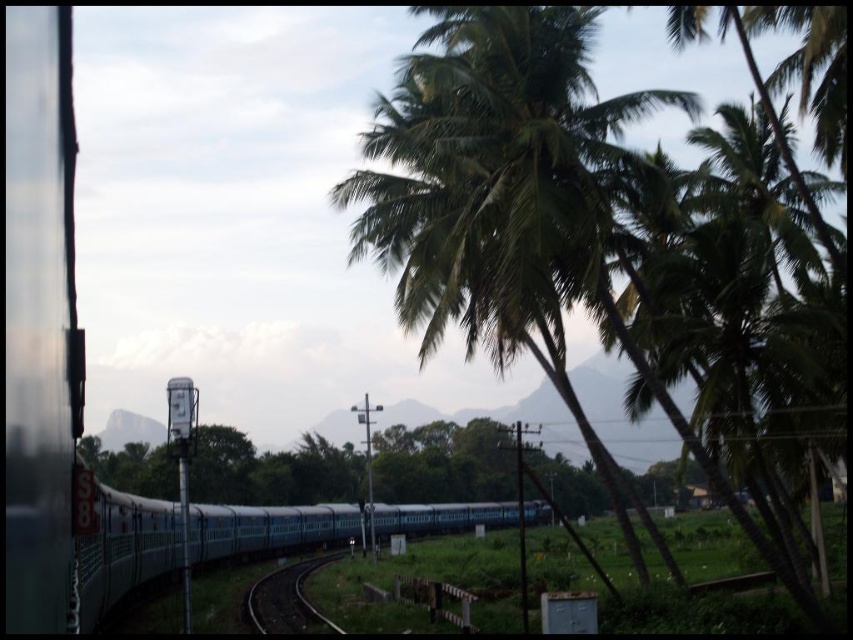
You are standing at the point marked as point (486, 145) in the image. What object is directly in front of you?

The point (486, 145) corresponds to a green leafy coconut tree at center, so the object directly in front of you is the green leafy coconut tree at center.

You are standing at the window edge on the left side of your train and want to take a photo of the green leafy coconut tree at center. Where should you aim your camera relative to the window frame?

You should aim your camera towards the center of the window frame since the green leafy coconut tree at center is located at point (486, 145), which is near the center of the image.

You are standing at the point closest to the window frame on the left side of the train. You see two points marked in the scene, point 1 at coordinates point (389, 200) and point 2 at coordinates point (254, 596). Which point is closer to you?

Point (389, 200) is closer to the viewer than point (254, 596), so the closer point is point (389, 200).